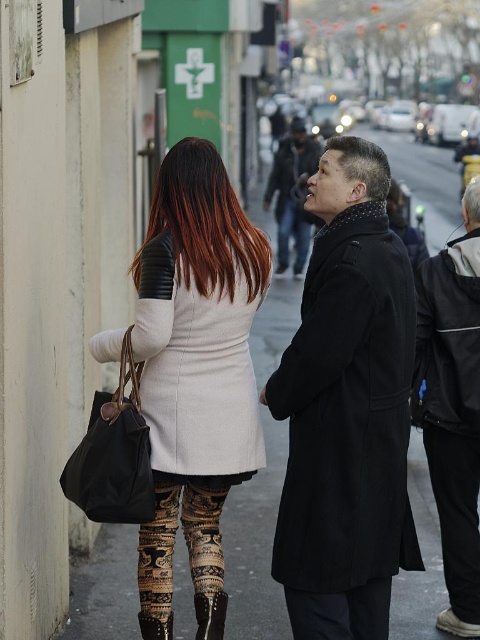
What do you see at coordinates (195, 364) in the screenshot? The image size is (480, 640). I see `matte white coat at center` at bounding box center [195, 364].

This screenshot has width=480, height=640. I want to click on matte white coat at center, so click(x=195, y=364).

Describe the element at coordinates (195, 364) in the screenshot. I see `matte white coat at center` at that location.

What are the coordinates of `matte white coat at center` in the screenshot? It's located at (195, 364).

Who is lower down, leather/textured boot at lower center or leather textured boot at lower center?

Positioned lower is leather textured boot at lower center.

Which of these two, leather/textured boot at lower center or leather textured boot at lower center, stands shorter?

leather textured boot at lower center is shorter.

You are a GUI agent. You are given a task and a screenshot of the screen. Output one action in this format:
    pyautogui.click(x=<x>, y=<y>)
    Task: Click on the leather/textured boot at lower center
    This screenshot has height=640, width=480.
    Given the screenshot: What is the action you would take?
    pos(210,614)

Is matte white coat at center below leather textured boot at lower center?

No, matte white coat at center is not below leather textured boot at lower center.

Between matte white coat at center and leather textured boot at lower center, which one is positioned higher?

Positioned higher is matte white coat at center.

Find the location of a particular element. Image resolution: width=480 pixels, height=640 pixels. matte white coat at center is located at coordinates (195, 364).

Where is `matte white coat at center`? The width and height of the screenshot is (480, 640). matte white coat at center is located at coordinates (195, 364).